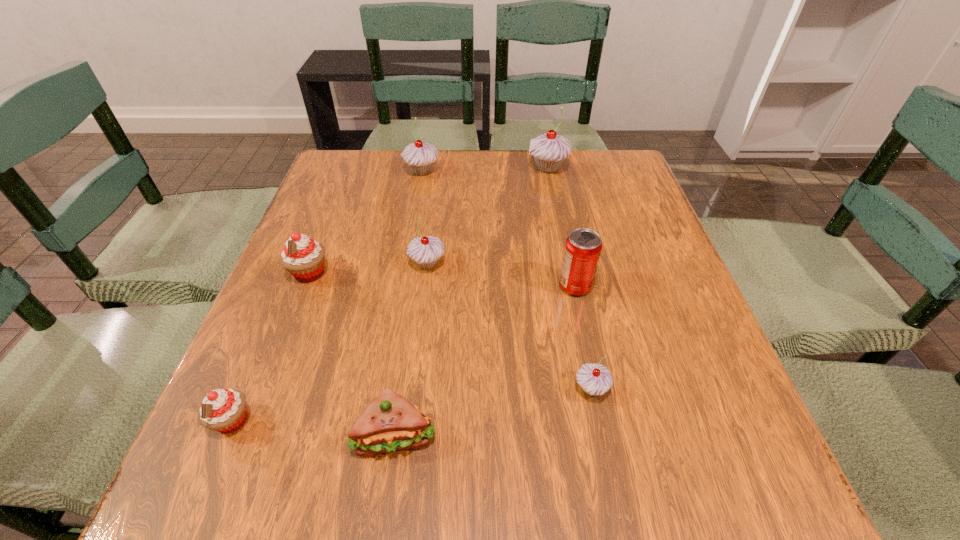
Locate an element on the screen. The image size is (960, 540). the tallest object is located at coordinates [549, 150].

In order to click on the biggest gray cupcake in this screenshot , I will do `click(549, 150)`.

What are the coordinates of `the fifth shortest cupcake` in the screenshot? It's located at (419, 156).

The height and width of the screenshot is (540, 960). Find the location of `red soda can`. red soda can is located at coordinates (583, 246).

Where is `the second nearest gray cupcake`? the second nearest gray cupcake is located at coordinates (425, 251).

Where is `the bigger pink cupcake`? The height and width of the screenshot is (540, 960). the bigger pink cupcake is located at coordinates (302, 257).

You are a GUI agent. You are given a task and a screenshot of the screen. Output one action in this format:
    pyautogui.click(x=<x>, y=<y>)
    Task: Click on the sandwich
    This screenshot has height=540, width=960.
    Given the screenshot: What is the action you would take?
    pyautogui.click(x=390, y=422)

What are the coordinates of `the nearest gray cupcake` in the screenshot? It's located at (595, 379).

Locate an element on the screen. This screenshot has width=960, height=540. the smaller pink cupcake is located at coordinates (224, 410).

Locate an element on the screen. free point located on the left of the biggest gray cupcake is located at coordinates (395, 168).